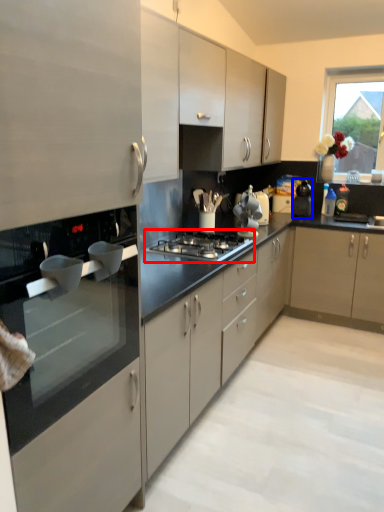
Question: Which object is closer to the camera taking this photo, gas stove (highlighted by a red box) or kitchen appliance (highlighted by a blue box)?

Choices:
 (A) gas stove
 (B) kitchen appliance

Answer: (A)